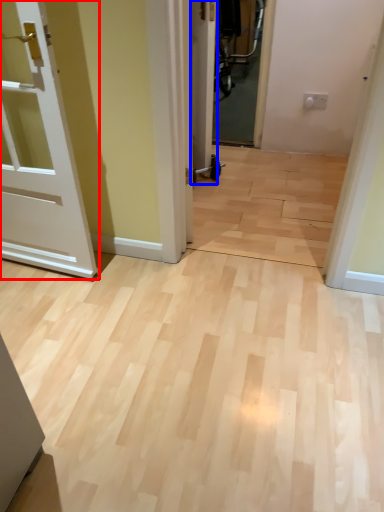
Question: Among these objects, which one is nearest to the camera, door (highlighted by a red box) or door (highlighted by a blue box)?

Choices:
 (A) door
 (B) door

Answer: (A)